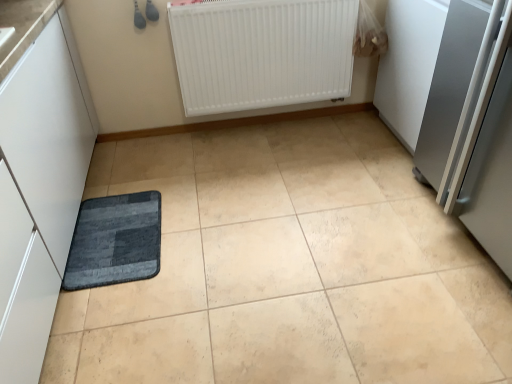
Question: Choose the correct answer: Is white matte radiator at upper center inside satin silver refrigerator at right or outside it?

Choices:
 (A) inside
 (B) outside

Answer: (B)

Question: Is white matte radiator at upper center wider or thinner than satin silver refrigerator at right?

Choices:
 (A) wide
 (B) thin

Answer: (B)

Question: Estimate the real-world distances between objects in this image. Which object is closer to the white matte radiator at upper center?

Choices:
 (A) satin silver refrigerator at right
 (B) dark gray textured mat at lower left

Answer: (A)

Question: Which is nearer to the white matte radiator at upper center?

Choices:
 (A) satin silver refrigerator at right
 (B) dark gray textured mat at lower left

Answer: (A)